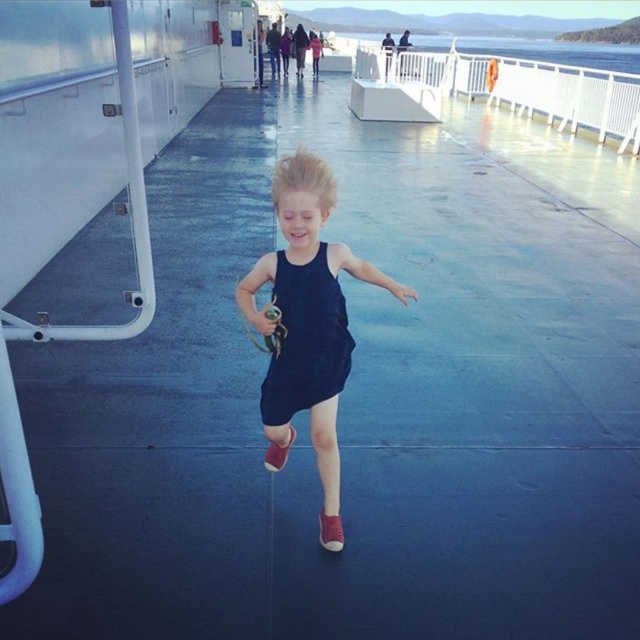
Does navy matte dress at center lie behind matte red shoe at center?

No, it is in front of matte red shoe at center.

How distant is navy matte dress at center from matte red shoe at center?

They are 17.77 inches apart.

Is point (356, 257) more distant than point (275, 461)?

Yes, point (356, 257) is farther from viewer.

Where is `navy matte dress at center`? navy matte dress at center is located at coordinates (307, 314).

Can you confirm if black matte dress at center is positioned above suede-like brown shoe at center?

Yes.

Measure the distance from black matte dress at center to suede-like brown shoe at center.

black matte dress at center is 63.60 centimeters from suede-like brown shoe at center.

Is point (292, 324) more distant than point (330, 540)?

No.

The image size is (640, 640). Identify the location of black matte dress at center. (305, 339).

Does suede-like brown shoe at center have a greater height compared to matte red shoe at center?

In fact, suede-like brown shoe at center may be shorter than matte red shoe at center.

Who is positioned more to the right, suede-like brown shoe at center or matte red shoe at center?

suede-like brown shoe at center is more to the right.

At what (x,y) coordinates should I click in order to perform the action: click on suede-like brown shoe at center. Please return your answer as a coordinate pair (x, y). The image size is (640, 640). Looking at the image, I should click on (330, 531).